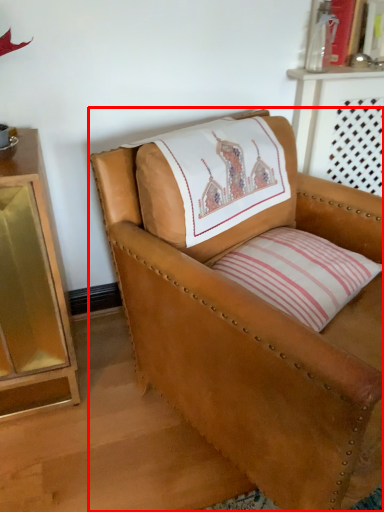
Question: From the image's perspective, where is chair (annotated by the red box) located relative to pillow?

Choices:
 (A) below
 (B) above

Answer: (A)